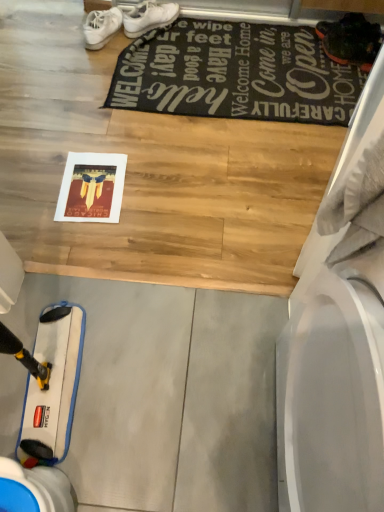
You are a GUI agent. You are given a task and a screenshot of the screen. Output one action in this format:
    pyautogui.click(x=<x>, y=<y>)
    Task: Click on the free space in front of white matte sneakers at upper center
    The height and width of the screenshot is (512, 384).
    Given the screenshot: What is the action you would take?
    pyautogui.click(x=84, y=91)